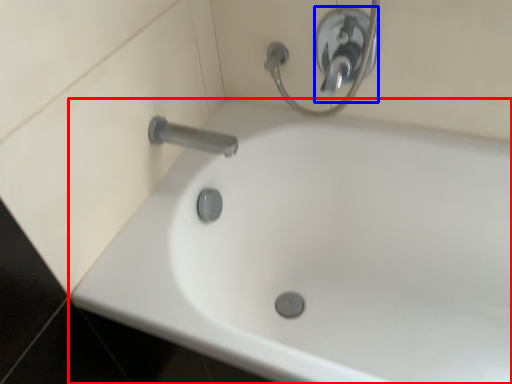
Question: Which object is closer to the camera taking this photo, bathtub (highlighted by a red box) or shower (highlighted by a blue box)?

Choices:
 (A) bathtub
 (B) shower

Answer: (A)